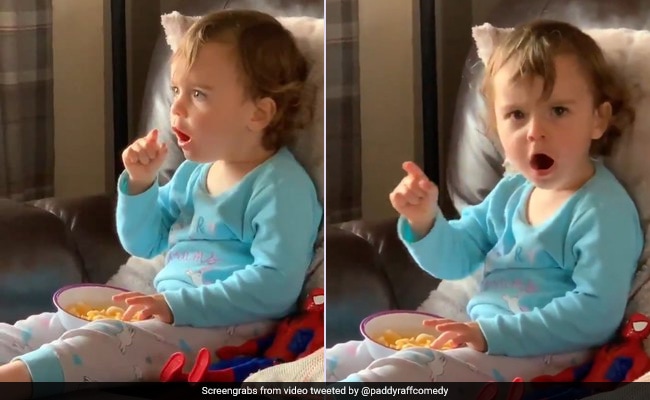
Locate an element on the screen. The height and width of the screenshot is (400, 650). chair is located at coordinates (x=80, y=231), (x=368, y=253).